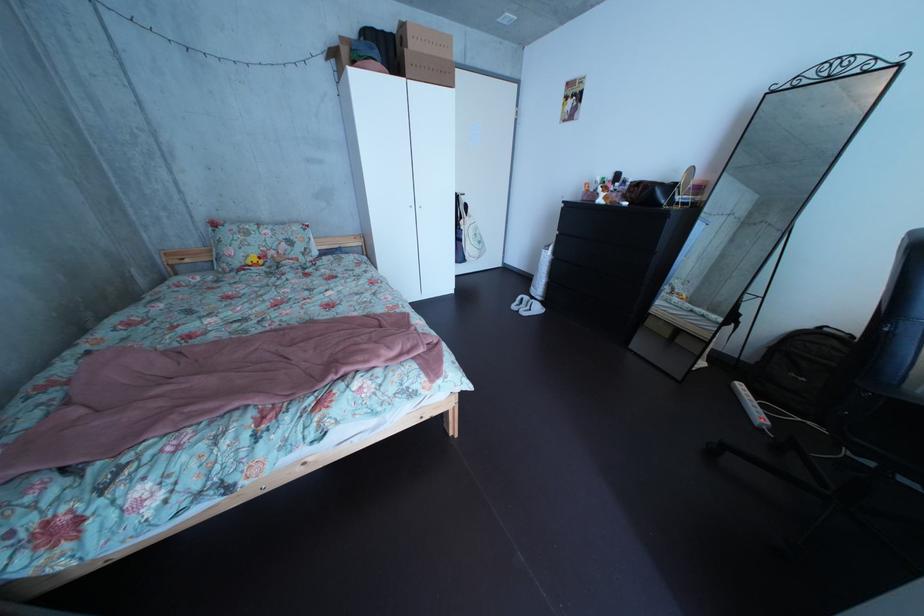
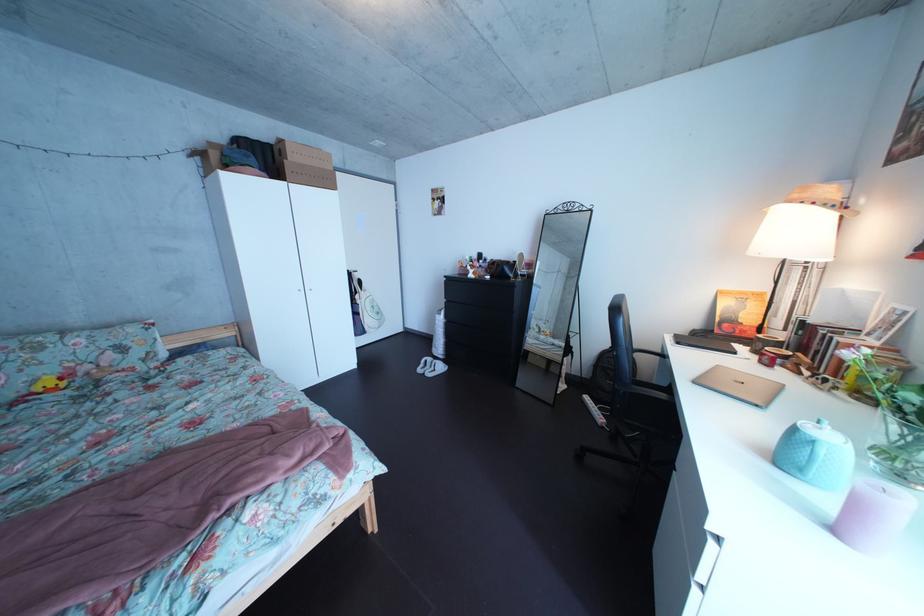
Question: Which direction would the cameraman need to move to produce the second image? Reply with the corresponding letter.

Choices:
 (A) Left
 (B) Right
 (C) Forward
 (D) Backward

Answer: (D)